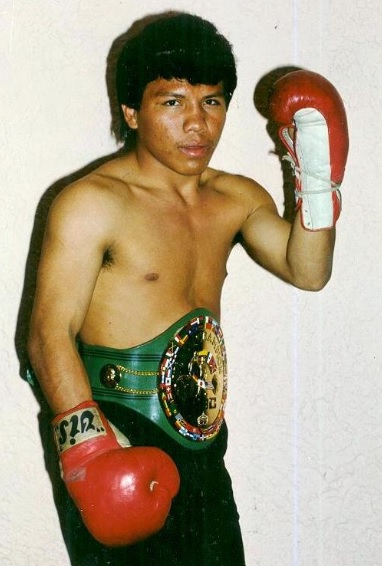
At what (x,y) coordinates should I click in order to perform the action: click on chest. Please return your answer as a coordinate pair (x, y). Image resolution: width=382 pixels, height=566 pixels. Looking at the image, I should click on (164, 233), (214, 241).